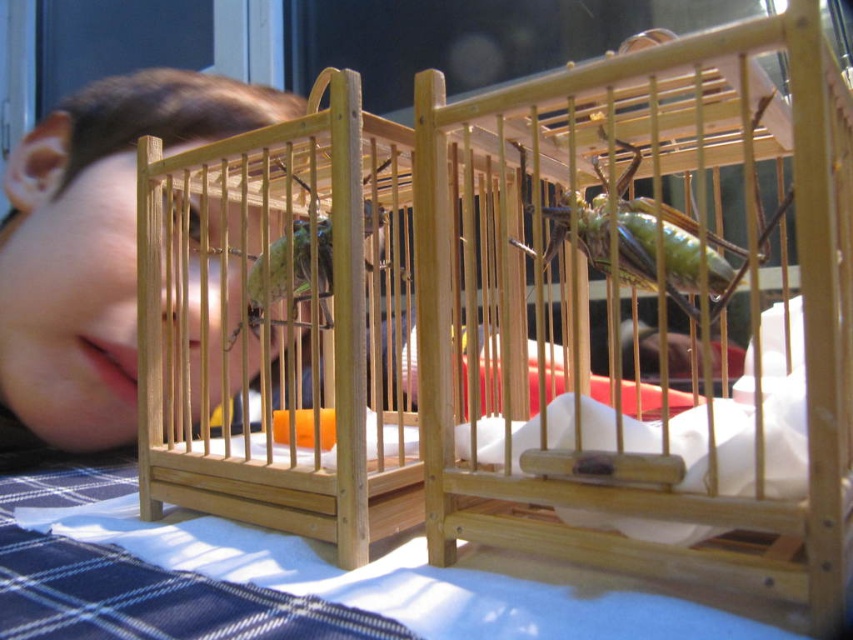
Does smooth skin face at upper left have a smaller size compared to green matte grasshopper at center?

No.

Is point (0, 323) positioned in front of point (305, 292)?

No, it is not.

This screenshot has height=640, width=853. What are the coordinates of `smooth skin face at upper left` in the screenshot? It's located at (94, 248).

Is green matte insect at center thinner than green matte grasshopper at center?

No, green matte insect at center is not thinner than green matte grasshopper at center.

Is green matte insect at center closer to camera compared to green matte grasshopper at center?

That is True.

Between point (598, 248) and point (257, 316), which one is positioned behind?

Positioned behind is point (257, 316).

You are a GUI agent. You are given a task and a screenshot of the screen. Output one action in this format:
    pyautogui.click(x=<x>, y=<y>)
    Task: Click on the green matte insect at center
    The height and width of the screenshot is (640, 853).
    Given the screenshot: What is the action you would take?
    pyautogui.click(x=670, y=248)

Does smooth skin face at upper left appear over green matte insect at center?

Yes.

Between point (59, 177) and point (683, 296), which one is positioned in front?

Point (683, 296)

Where is `smooth skin face at upper left`? The width and height of the screenshot is (853, 640). smooth skin face at upper left is located at coordinates (94, 248).